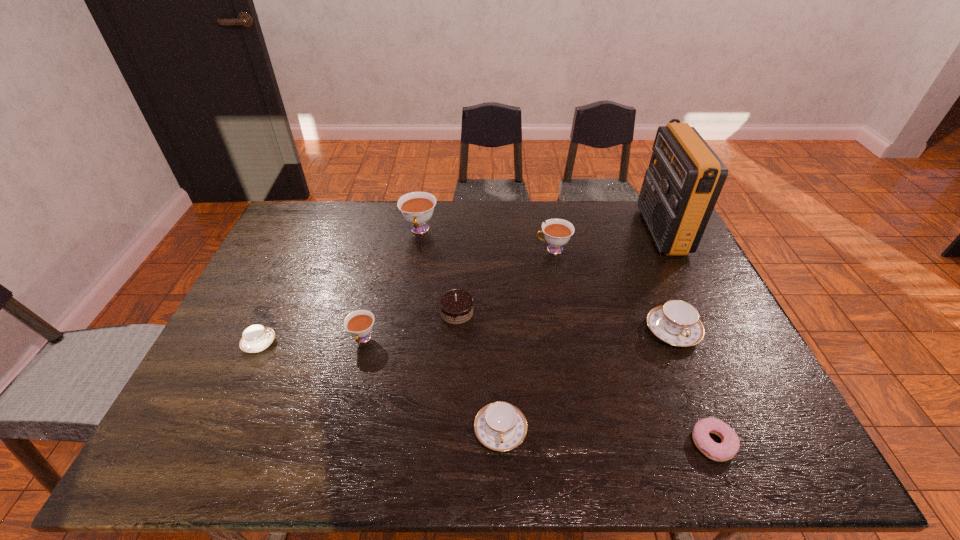
Find the location of a particular element. This screenshot has height=540, width=960. doughnut present at the near edge is located at coordinates (730, 443).

Identify the location of object present at the left edge. The image size is (960, 540). (255, 338).

Locate an element on the screen. radio receiver at the right edge is located at coordinates (685, 177).

Find the location of a particular element. This screenshot has height=540, width=960. teacup present at the right edge is located at coordinates (676, 322).

Identify the location of doughnut located in the right edge section of the desktop. This screenshot has width=960, height=540. (730, 443).

In order to click on object located in the far right corner section of the desktop in this screenshot , I will do `click(685, 177)`.

This screenshot has height=540, width=960. In order to click on object that is at the near right corner in this screenshot , I will do `click(730, 443)`.

Locate an element on the screen. vacant space at the far edge is located at coordinates (577, 239).

Image resolution: width=960 pixels, height=540 pixels. What are the coordinates of `vacant space at the near edge of the desktop` in the screenshot? It's located at (260, 436).

This screenshot has height=540, width=960. In the image, there is a desktop. In order to click on free region at the left edge in this screenshot , I will do `click(264, 369)`.